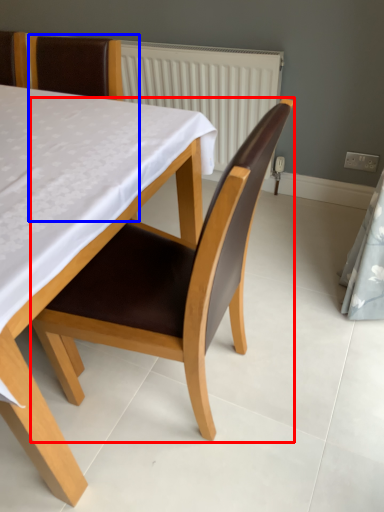
Question: Among these objects, which one is nearest to the camera, chair (highlighted by a red box) or chair (highlighted by a blue box)?

Choices:
 (A) chair
 (B) chair

Answer: (A)